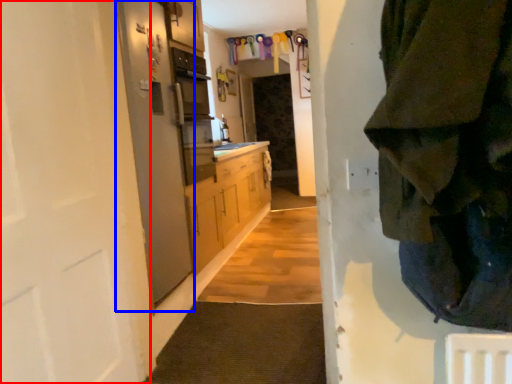
Question: Which object is closer to the camera taking this photo, door (highlighted by a red box) or screen door (highlighted by a blue box)?

Choices:
 (A) door
 (B) screen door

Answer: (A)